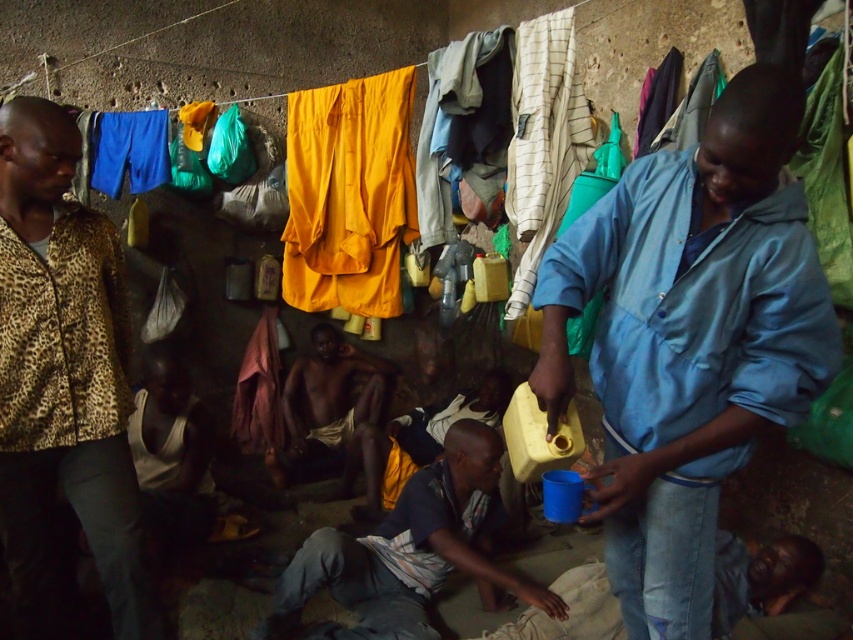
You are a photographer trying to capture a candid shot of the dark skin man at center without including the leopard print jacket at left in the frame. Based on their positions, is this possible?

The leopard print jacket at left is to the left of dark skin man at center, so if you position yourself to the right side of the dark skin man at center, you can frame the shot to exclude the leopard print jacket at left.

You are standing at the point marked as point (541, 636) in the image. You want to hand a small item to the person sitting in the foreground. Can you reach them without moving from your current position?

The distance between you and the person is 2.60 meters. Since the item is small, you might be able to throw it, but reaching directly would require closer proximity. However, the question specifies not moving from your position, so you cannot physically hand it over without moving.

You are standing at the point marked by the coordinates point (62,380). Looking around the scene described, which object or person is located at that exact coordinate?

The leopard print jacket at left is located at point (62,380).